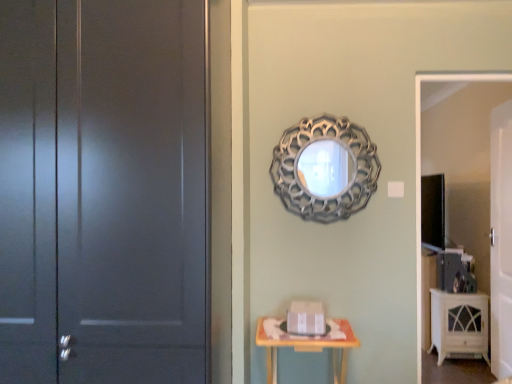
Describe the element at coordinates (307, 348) in the screenshot. This screenshot has width=512, height=384. I see `wooden table at lower center` at that location.

This screenshot has height=384, width=512. I want to click on matte gray door at left, which is counted as the 2th door, starting from the right, so click(x=102, y=191).

Locate an element on the screen. white glossy cabinet at lower right is located at coordinates (459, 325).

Does matte gray door at left, the second door in the back-to-front sequence, have a larger size compared to white glossy tv stand at right?

Yes, matte gray door at left, the second door in the back-to-front sequence, is bigger than white glossy tv stand at right.

From the image's perspective, is matte gray door at left, the second door in the back-to-front sequence, located beneath white glossy tv stand at right?

No.

Between matte gray door at left, the second door in the back-to-front sequence, and white glossy tv stand at right, which one appears on the left side from the viewer's perspective?

From the viewer's perspective, matte gray door at left, the second door in the back-to-front sequence, appears more on the left side.

Is matte gray door at left, the second door in the back-to-front sequence, completely or partially outside of white glossy tv stand at right?

Yes, matte gray door at left, the second door in the back-to-front sequence, is outside of white glossy tv stand at right.

Is wooden table at lower center not close to white glossy door at right, the first door when ordered from back to front?

wooden table at lower center is far away from white glossy door at right, the first door when ordered from back to front.

In terms of size, does wooden table at lower center appear bigger or smaller than white glossy door at right, which is the 2th door from left to right?

wooden table at lower center is smaller than white glossy door at right, which is the 2th door from left to right.

Is wooden table at lower center wider than white glossy door at right, the first door when ordered from back to front?

Correct, the width of wooden table at lower center exceeds that of white glossy door at right, the first door when ordered from back to front.

Between wooden table at lower center and white glossy door at right, which is the first door in right-to-left order, which one has more height?

With more height is white glossy door at right, which is the first door in right-to-left order.

Considering the points (272, 349) and (378, 171), which point is behind, point (272, 349) or point (378, 171)?

The point (378, 171) is more distant.

Is wooden table at lower center placed right next to silver metallic mirror at upper center?

No, wooden table at lower center is not next to silver metallic mirror at upper center.

From the image's perspective, which object appears higher, wooden table at lower center or silver metallic mirror at upper center?

From the image's view, silver metallic mirror at upper center is above.

From the picture: In the image, is wooden table at lower center positioned in front of or behind white glossy cabinet at lower right?

wooden table at lower center is in front of white glossy cabinet at lower right.

Looking at this image, from a real-world perspective, between wooden table at lower center and white glossy cabinet at lower right, who is vertically lower?

white glossy cabinet at lower right is physically lower.

Based on the photo, is wooden table at lower center oriented away from white glossy cabinet at lower right?

No.

Is white glossy door at right, the first door when ordered from back to front, turned away from silver metallic mirror at upper center?

No, silver metallic mirror at upper center is not at the back of white glossy door at right, the first door when ordered from back to front.

Is white glossy door at right, which is the 2th door from left to right, in front of or behind silver metallic mirror at upper center in the image?

white glossy door at right, which is the 2th door from left to right, is behind silver metallic mirror at upper center.

Is white glossy door at right, which is the first door in right-to-left order, next to silver metallic mirror at upper center?

No, white glossy door at right, which is the first door in right-to-left order, is not making contact with silver metallic mirror at upper center.

Between white glossy door at right, the second door from the front, and silver metallic mirror at upper center, which one has less height?

silver metallic mirror at upper center.

Considering the relative sizes of white glossy door at right, the second door from the front, and white glossy tv stand at right in the image provided, is white glossy door at right, the second door from the front, wider than white glossy tv stand at right?

Yes, white glossy door at right, the second door from the front, is wider than white glossy tv stand at right.

How distant is white glossy door at right, which is the 2th door from left to right, from white glossy tv stand at right?

38.55 inches.

In terms of size, does white glossy door at right, the first door when ordered from back to front, appear bigger or smaller than white glossy tv stand at right?

Considering their sizes, white glossy door at right, the first door when ordered from back to front, takes up more space than white glossy tv stand at right.

Which is nearer, (494, 120) or (418, 88)?

Point (418, 88)

In the scene shown: From a real-world perspective, is white glossy cabinet at lower right on top of white glossy door at right, the first door when ordered from back to front?

Incorrect, from a real-world perspective, white glossy cabinet at lower right is lower than white glossy door at right, the first door when ordered from back to front.

Is white glossy cabinet at lower right not near white glossy door at right, the second door from the front?

No, there isn't a large distance between white glossy cabinet at lower right and white glossy door at right, the second door from the front.

Is white glossy cabinet at lower right at the right side of white glossy door at right, the second door from the front?

In fact, white glossy cabinet at lower right is to the left of white glossy door at right, the second door from the front.

From the image's perspective, is white glossy cabinet at lower right located beneath white glossy door at right, which is the 2th door from left to right?

Yes.

Find the location of a particular element. door that is above the white glossy tv stand at right (from a real-world perspective) is located at coordinates (102, 191).

This screenshot has width=512, height=384. Find the location of `table below the white glossy door at right, the first door when ordered from back to front (from the image's perspective)`. table below the white glossy door at right, the first door when ordered from back to front (from the image's perspective) is located at coordinates (307, 348).

Based on their spatial positions, is wooden table at lower center or silver metallic mirror at upper center closer to white glossy tv stand at right?

Based on the image, silver metallic mirror at upper center appears to be nearer to white glossy tv stand at right.

Which object lies further to the anchor point white glossy door at right, which is the 2th door from left to right, wooden table at lower center or white glossy tv stand at right?

wooden table at lower center lies further to white glossy door at right, which is the 2th door from left to right, than the other object.

Estimate the real-world distances between objects in this image. Which object is closer to white glossy door at right, the first door when ordered from back to front, white glossy cabinet at lower right or white glossy tv stand at right?

Based on the image, white glossy cabinet at lower right appears to be nearer to white glossy door at right, the first door when ordered from back to front.

Looking at the image, which one is located further to silver metallic mirror at upper center, wooden table at lower center or white glossy cabinet at lower right?

Among the two, white glossy cabinet at lower right is located further to silver metallic mirror at upper center.

From the image, which object appears to be farther from white glossy cabinet at lower right, white glossy door at right, which is the 2th door from left to right, or wooden table at lower center?

wooden table at lower center lies further to white glossy cabinet at lower right than the other object.

Looking at the image, which one is located further to white glossy cabinet at lower right, silver metallic mirror at upper center or white glossy tv stand at right?

Among the two, silver metallic mirror at upper center is located further to white glossy cabinet at lower right.

When comparing their distances from wooden table at lower center, does matte gray door at left, which is counted as the 2th door, starting from the right, or white glossy tv stand at right seem closer?

white glossy tv stand at right is closer to wooden table at lower center.

Estimate the real-world distances between objects in this image. Which object is closer to white glossy tv stand at right, silver metallic mirror at upper center or white glossy cabinet at lower right?

The object closer to white glossy tv stand at right is silver metallic mirror at upper center.

Where is `screen door situated between wooden table at lower center and white glossy door at right, the second door from the front, from left to right`? The width and height of the screenshot is (512, 384). screen door situated between wooden table at lower center and white glossy door at right, the second door from the front, from left to right is located at coordinates (420, 168).

The image size is (512, 384). What are the coordinates of `screen door located between silver metallic mirror at upper center and white glossy cabinet at lower right in the left-right direction` in the screenshot? It's located at (420, 168).

At what (x,y) coordinates should I click in order to perform the action: click on mirror between matte gray door at left, the second door in the back-to-front sequence, and white glossy door at right, which is the first door in right-to-left order, from left to right. Please return your answer as a coordinate pair (x, y). This screenshot has width=512, height=384. Looking at the image, I should click on (325, 168).

Image resolution: width=512 pixels, height=384 pixels. I want to click on table between matte gray door at left, which is counted as the 2th door, starting from the right, and white glossy door at right, the second door from the front, from left to right, so click(x=307, y=348).